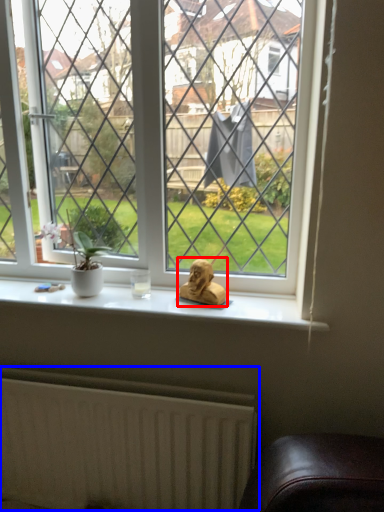
Question: Among these objects, which one is nearest to the camera, animal (highlighted by a red box) or radiator (highlighted by a blue box)?

Choices:
 (A) animal
 (B) radiator

Answer: (B)